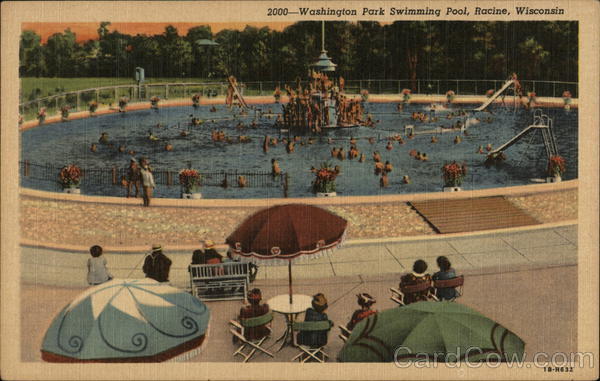
The height and width of the screenshot is (381, 600). Find the location of `table shade covering`. table shade covering is located at coordinates (289, 228), (133, 315), (432, 335).